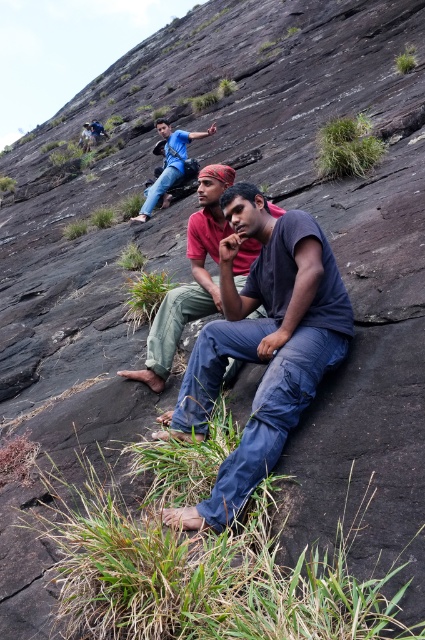
You are standing at the point marked as point (263,346) in the image. Looking around, you see a dark blue cotton shirt at center and a red shirt and green pants. Which person is closer to you?

The dark blue cotton shirt at center is exactly at the point (263,346), so it is the closest to you.

You are a photographer trying to capture a candid shot of the dark blue cotton shirt at center and the dark blue jeans at center. If you want to ensure both are fully visible in the frame, which clothing item should you focus on to avoid cropping?

The dark blue cotton shirt at center might be wider than dark blue jeans at center, so focusing on the wider dark blue cotton shirt at center would ensure both are fully visible without cropping.

You are a photographer trying to capture a candid shot of the dark blue cotton shirt at center and the dark blue jeans at center. Since you want to ensure both are in focus, you need to know their relative sizes in the frame. Which of the two is larger?

The dark blue cotton shirt at center is taller than dark blue jeans at center, so the shirt is larger in the frame.